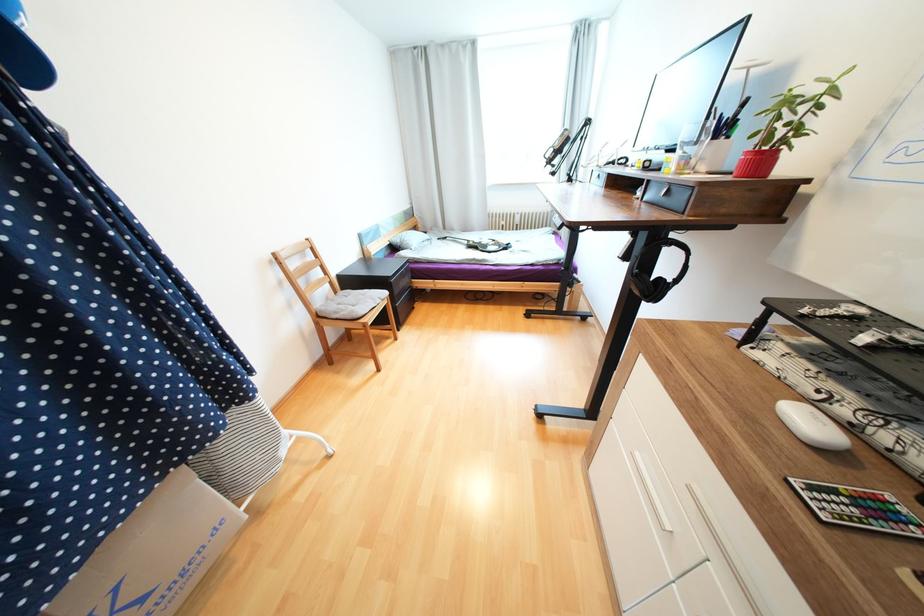
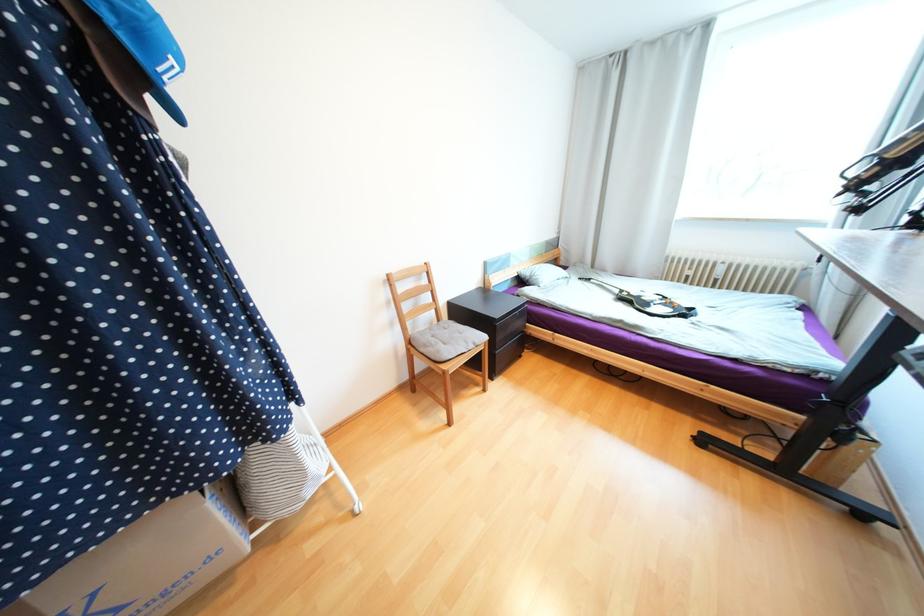
Question: Based on the continuous images, in which direction is the camera rotating? Reply with the corresponding letter.

Choices:
 (A) Left
 (B) Right
 (C) Up
 (D) Down

Answer: (A)